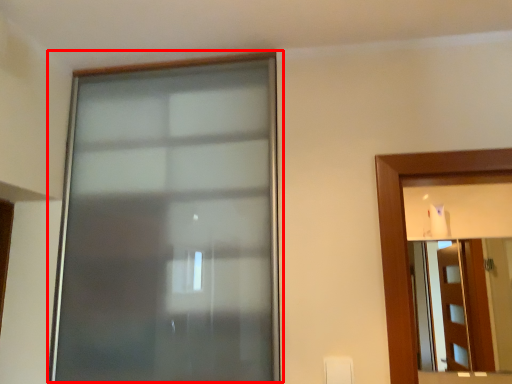
Question: Observing the image, what is the correct spatial positioning of window (annotated by the red box) in reference to mirror?

Choices:
 (A) left
 (B) right

Answer: (A)